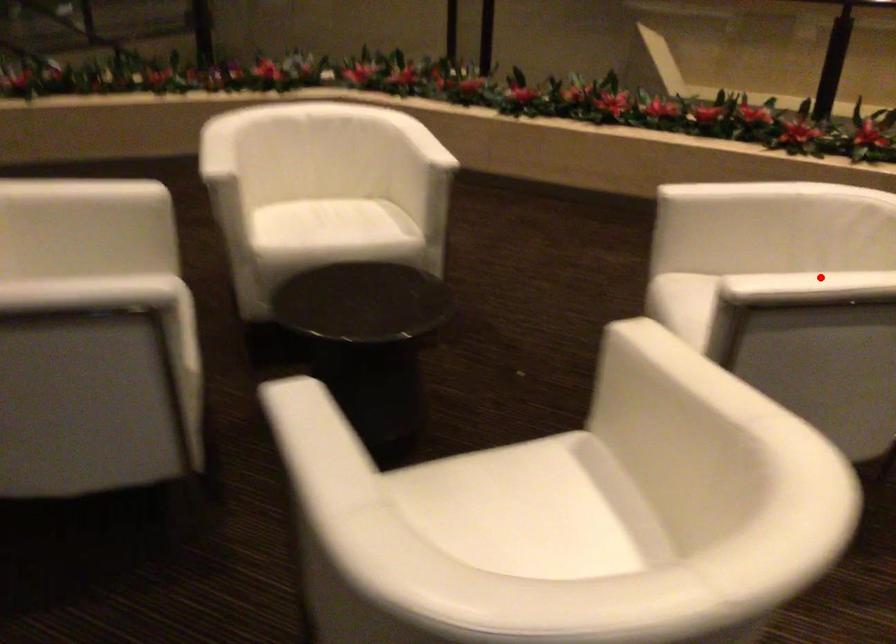
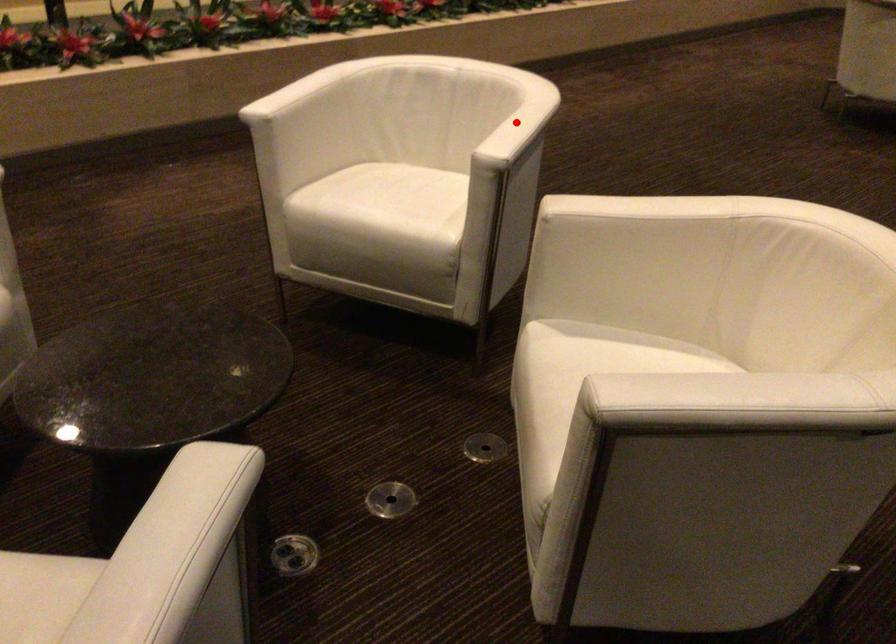
I am providing you with two images of the same scene from different viewpoints. A red point is marked on the first image and another point is marked on the second image. Is the red point in image1 aligned with the point shown in image2?

Yes